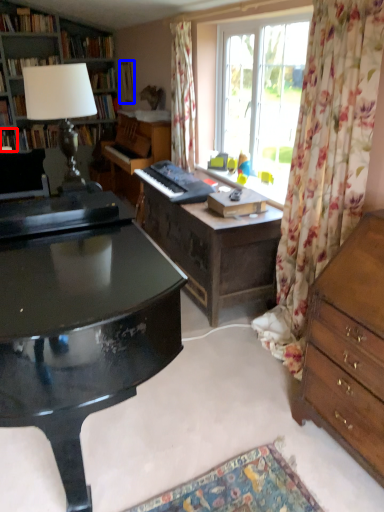
Question: Which point is closer to the camera, book (highlighted by a red box) or book (highlighted by a blue box)?

Choices:
 (A) book
 (B) book

Answer: (B)